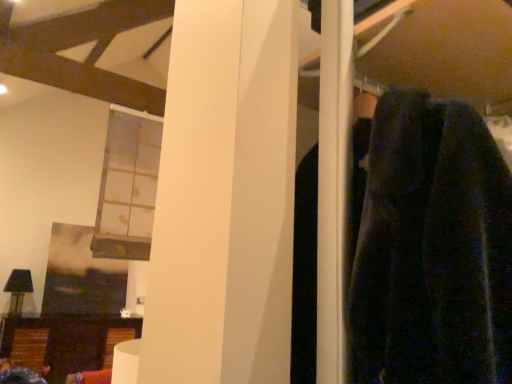
The image size is (512, 384). I want to click on wooden side table at lower left, so [65, 342].

What do you see at coordinates (65, 342) in the screenshot? The width and height of the screenshot is (512, 384). I see `wooden side table at lower left` at bounding box center [65, 342].

Image resolution: width=512 pixels, height=384 pixels. Describe the element at coordinates (127, 188) in the screenshot. I see `translucent glass window at upper left` at that location.

In order to click on translucent glass window at upper left in this screenshot , I will do `click(127, 188)`.

The image size is (512, 384). I want to click on wooden side table at lower left, so click(x=65, y=342).

Is wooden side table at lower left to the right of translucent glass window at upper left from the viewer's perspective?

No, wooden side table at lower left is not to the right of translucent glass window at upper left.

From the picture: Is the depth of wooden side table at lower left greater than that of translucent glass window at upper left?

Yes, wooden side table at lower left is further from the viewer.

Which is closer, (105, 329) or (137, 200)?

Point (105, 329).

Consider the image. From the image's perspective, does wooden side table at lower left appear higher than translucent glass window at upper left?

No, from the image's perspective, wooden side table at lower left is not over translucent glass window at upper left.

From a real-world perspective, is wooden side table at lower left over translucent glass window at upper left?

No, from a real-world perspective, wooden side table at lower left is not over translucent glass window at upper left

Is wooden side table at lower left wider than translucent glass window at upper left?

Yes, wooden side table at lower left is wider than translucent glass window at upper left.

Considering the relative sizes of wooden side table at lower left and translucent glass window at upper left in the image provided, is wooden side table at lower left shorter than translucent glass window at upper left?

Indeed, wooden side table at lower left has a lesser height compared to translucent glass window at upper left.

Is wooden side table at lower left bigger or smaller than translucent glass window at upper left?

Considering their sizes, wooden side table at lower left takes up more space than translucent glass window at upper left.

Is wooden side table at lower left not inside translucent glass window at upper left?

That's correct, wooden side table at lower left is outside of translucent glass window at upper left.

Is wooden side table at lower left placed right next to translucent glass window at upper left?

wooden side table at lower left is not next to translucent glass window at upper left, and they're not touching.

Is wooden side table at lower left facing away from translucent glass window at upper left?

No, translucent glass window at upper left is not at the back of wooden side table at lower left.

What are the coordinates of `furniture that appears behind the translucent glass window at upper left` in the screenshot? It's located at (65, 342).

Which is more to the right, translucent glass window at upper left or wooden side table at lower left?

translucent glass window at upper left.

Is the position of translucent glass window at upper left more distant than that of wooden side table at lower left?

No.

Considering the points (151, 135) and (106, 347), which point is behind, point (151, 135) or point (106, 347)?

Point (106, 347)

In the scene shown: From the image's perspective, between translucent glass window at upper left and wooden side table at lower left, which one is located above?

translucent glass window at upper left is shown above in the image.

Based on the photo, from a real-world perspective, between translucent glass window at upper left and wooden side table at lower left, who is vertically lower?

In real-world perspective, wooden side table at lower left is lower.

Does translucent glass window at upper left have a lesser width compared to wooden side table at lower left?

Yes, translucent glass window at upper left is thinner than wooden side table at lower left.

Looking at this image, considering the relative sizes of translucent glass window at upper left and wooden side table at lower left in the image provided, is translucent glass window at upper left taller than wooden side table at lower left?

Yes, translucent glass window at upper left is taller than wooden side table at lower left.

Considering the sizes of objects translucent glass window at upper left and wooden side table at lower left in the image provided, who is smaller, translucent glass window at upper left or wooden side table at lower left?

With smaller size is translucent glass window at upper left.

Is translucent glass window at upper left inside the boundaries of wooden side table at lower left, or outside?

translucent glass window at upper left is outside wooden side table at lower left.

Is translucent glass window at upper left positioned far away from wooden side table at lower left?

Yes, translucent glass window at upper left and wooden side table at lower left are quite far apart.

Could you tell me if translucent glass window at upper left is facing wooden side table at lower left?

Yes, translucent glass window at upper left is aimed at wooden side table at lower left.

This screenshot has height=384, width=512. There is a wooden side table at lower left. In order to click on window above it (from a real-world perspective) in this screenshot , I will do `click(127, 188)`.

Identify the location of window in front of the wooden side table at lower left. (127, 188).

Identify the location of window above the wooden side table at lower left (from a real-world perspective). This screenshot has width=512, height=384. (127, 188).